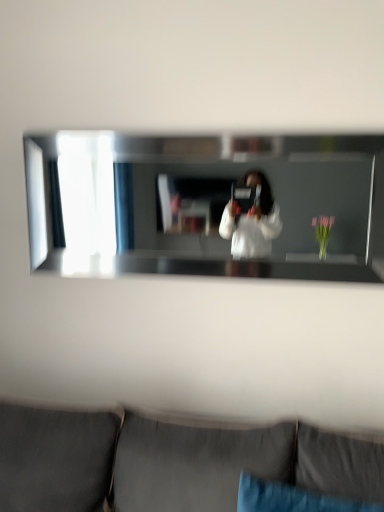
Question: From the image's perspective, is dark gray fabric couch at lower center beneath blue fabric pillow at lower center?

Choices:
 (A) yes
 (B) no

Answer: (A)

Question: Does dark gray fabric couch at lower center have a greater width compared to blue fabric pillow at lower center?

Choices:
 (A) no
 (B) yes

Answer: (B)

Question: Is dark gray fabric couch at lower center with blue fabric pillow at lower center?

Choices:
 (A) yes
 (B) no

Answer: (B)

Question: Is dark gray fabric couch at lower center smaller than blue fabric pillow at lower center?

Choices:
 (A) no
 (B) yes

Answer: (A)

Question: Is blue fabric pillow at lower center inside dark gray fabric couch at lower center?

Choices:
 (A) yes
 (B) no

Answer: (A)

Question: From a real-world perspective, is dark gray fabric couch at lower center above or below blue fabric pillow at lower center?

Choices:
 (A) above
 (B) below

Answer: (B)

Question: Considering the positions of dark gray fabric couch at lower center and blue fabric pillow at lower center in the image, is dark gray fabric couch at lower center bigger or smaller than blue fabric pillow at lower center?

Choices:
 (A) small
 (B) big

Answer: (B)

Question: Which is correct: dark gray fabric couch at lower center is inside blue fabric pillow at lower center, or outside of it?

Choices:
 (A) outside
 (B) inside

Answer: (A)

Question: Considering the relative positions of dark gray fabric couch at lower center and blue fabric pillow at lower center in the image provided, is dark gray fabric couch at lower center to the left or to the right of blue fabric pillow at lower center?

Choices:
 (A) right
 (B) left

Answer: (B)

Question: Based on their positions, is clear glass mirror at center located to the left or right of dark gray fabric couch at lower center?

Choices:
 (A) right
 (B) left

Answer: (A)

Question: In the image, is clear glass mirror at center positioned in front of or behind dark gray fabric couch at lower center?

Choices:
 (A) behind
 (B) front

Answer: (A)

Question: In terms of width, does clear glass mirror at center look wider or thinner when compared to dark gray fabric couch at lower center?

Choices:
 (A) thin
 (B) wide

Answer: (A)

Question: From a real-world perspective, relative to dark gray fabric couch at lower center, is clear glass mirror at center vertically above or below?

Choices:
 (A) above
 (B) below

Answer: (A)

Question: Is clear glass mirror at center situated inside blue fabric pillow at lower center or outside?

Choices:
 (A) inside
 (B) outside

Answer: (B)

Question: Based on their sizes in the image, would you say clear glass mirror at center is bigger or smaller than blue fabric pillow at lower center?

Choices:
 (A) big
 (B) small

Answer: (A)